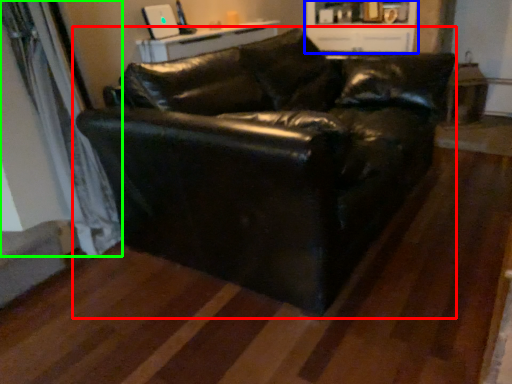
Question: Based on their relative distances, which object is nearer to studio couch (highlighted by a red box)? Choose from entertainment center (highlighted by a blue box) and curtain (highlighted by a green box).

Choices:
 (A) entertainment center
 (B) curtain

Answer: (B)